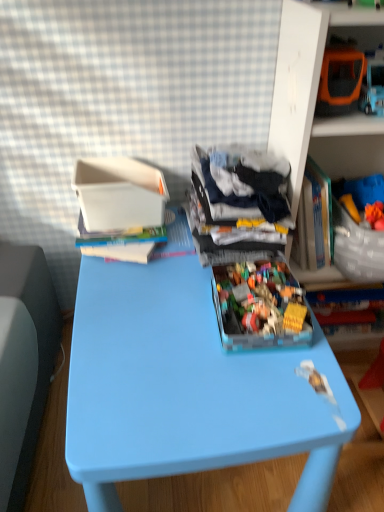
Identify the location of free space in front of translucent plastic container at center. (252, 396).